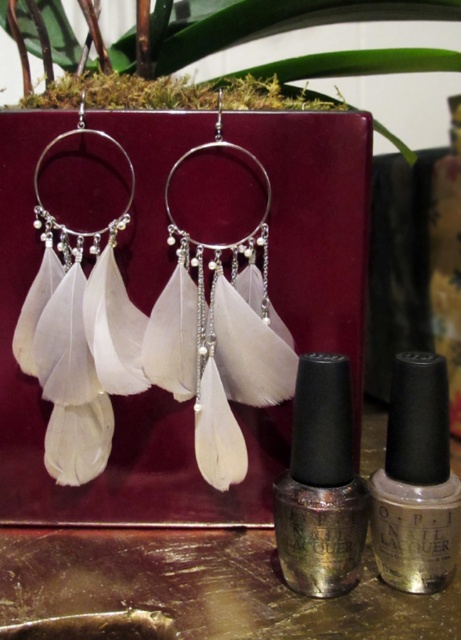
This screenshot has height=640, width=461. Describe the element at coordinates (320, 484) in the screenshot. I see `metallic silver nail polish at center` at that location.

Is point (319, 467) more distant than point (400, 420)?

No, it is in front of (400, 420).

You are a GUI agent. You are given a task and a screenshot of the screen. Output one action in this format:
    pyautogui.click(x=<x>, y=<y>)
    Task: Click on the metallic silver nail polish at center
    
    Given the screenshot: What is the action you would take?
    pyautogui.click(x=320, y=484)